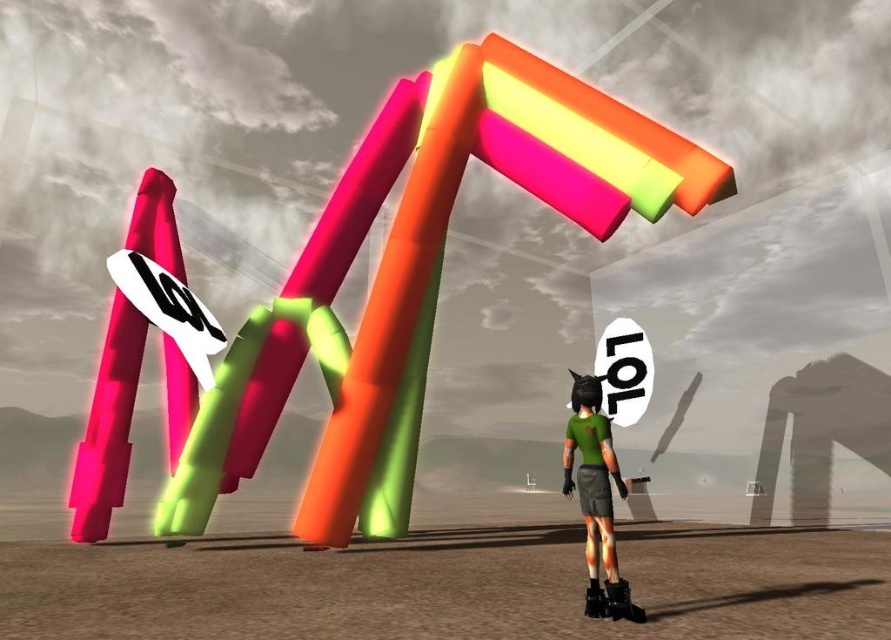
You are a visitor in this surreal scene and want to take a photo of the neon plastic sign at center and the matte pink pole at left. Which object is positioned higher in the scene?

The neon plastic sign at center is located above the matte pink pole at left, so it is positioned higher in the scene.

You are standing at the point labeled as point (x=405, y=413) in the scene. If you want to take a photo of the entire abstract structure with your camera, which is 3.96 meters away from you, will you be able to capture the entire structure in one shot?

Yes, since the camera is 3.96 meters away from point (x=405, y=413), you can capture the entire structure in one shot as the distance allows the camera to encompass the whole structure.

You are a character in the scene and want to place a new object at the point specified by the coordinates. The coordinates are given as a pair of numbers between 0 and 1, where 0 is the left edge and 1 is the right edge of the image. The first number represents the horizontal position, and the second represents the vertical position. Based on the scene description, what object is located at the point specified by the coordinates point (444, 240)?

The point (444, 240) corresponds to the neon plastic letters at center.